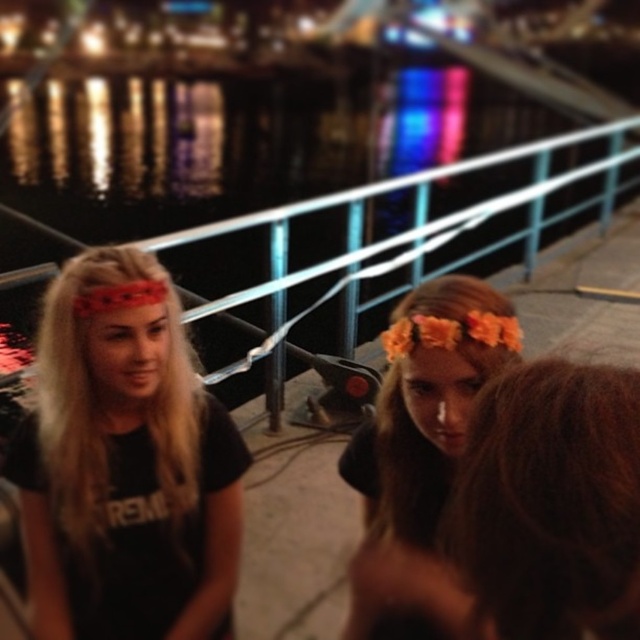
Is brown curly hair at center thinner than floral headband at center?

Indeed, brown curly hair at center has a lesser width compared to floral headband at center.

Who is more forward, (538, 620) or (480, 381)?

Point (538, 620) is more forward.

Which is behind, point (515, 374) or point (406, 387)?

The point (406, 387) is behind.

At what (x,y) coordinates should I click in order to perform the action: click on brown curly hair at center. Please return your answer as a coordinate pair (x, y). This screenshot has height=640, width=640. Looking at the image, I should click on (552, 500).

Between matte black shirt at left and floral headband at center, which one appears on the right side from the viewer's perspective?

floral headband at center is more to the right.

Between point (182, 588) and point (388, 392), which one is positioned in front?

Point (388, 392) is more forward.

Which is behind, point (44, 531) or point (410, 536)?

Positioned behind is point (44, 531).

Find the location of a particular element. The width and height of the screenshot is (640, 640). matte black shirt at left is located at coordinates [125, 461].

Is matte black shirt at left positioned at the back of brown curly hair at center?

Yes, it is behind brown curly hair at center.

Measure the distance between point (157, 625) and camera.

Point (157, 625) and camera are 5.17 feet apart.

Does point (88, 561) come closer to viewer compared to point (513, 600)?

That is False.

Image resolution: width=640 pixels, height=640 pixels. In order to click on matte black shirt at left in this screenshot , I will do `click(125, 461)`.